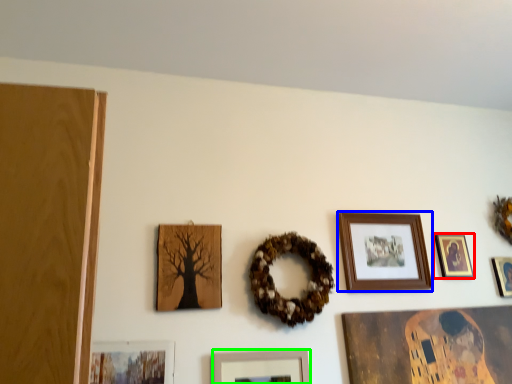
Question: Which object is the farthest from picture frame (highlighted by a red box)? Choose among these: picture frame (highlighted by a blue box) or picture frame (highlighted by a green box).

Choices:
 (A) picture frame
 (B) picture frame

Answer: (B)